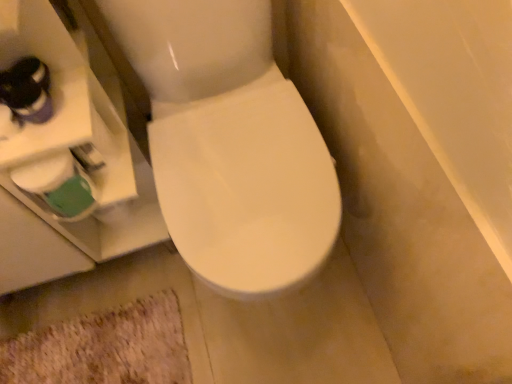
I want to click on free spot above beige shaggy bath mat at lower left (from a real-world perspective), so click(110, 344).